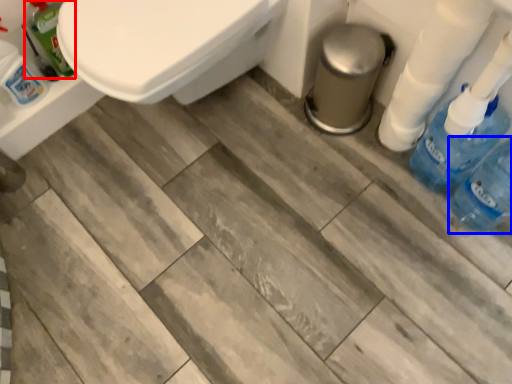
Question: Which point is further to the camera, cleaning product (highlighted by a red box) or bottle (highlighted by a blue box)?

Choices:
 (A) cleaning product
 (B) bottle

Answer: (A)